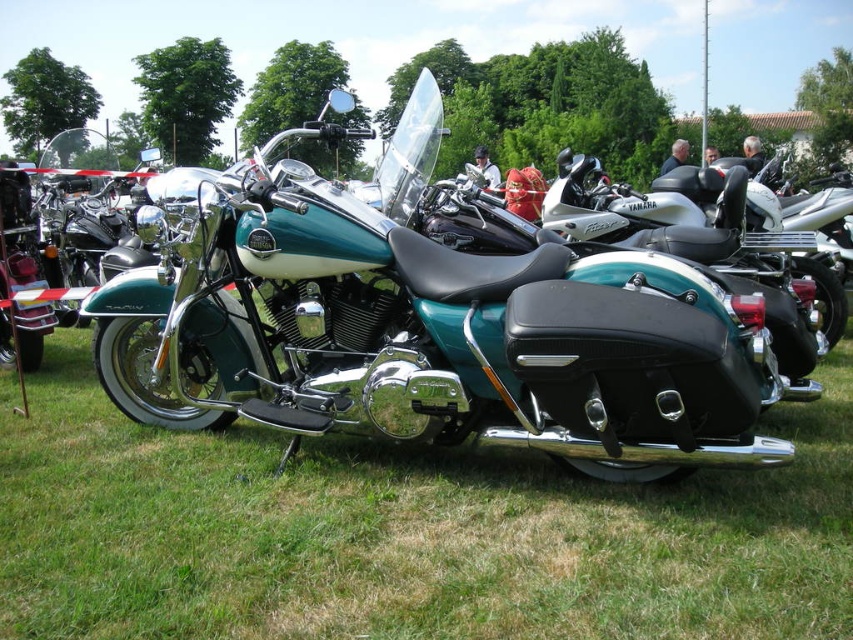
Question: Does green grass at center have a greater width compared to teal metallic motorcycle at center?

Choices:
 (A) no
 (B) yes

Answer: (B)

Question: Among these points, which one is nearest to the camera?

Choices:
 (A) (711, 168)
 (B) (254, 550)
 (C) (294, 188)

Answer: (B)

Question: Among these objects, which one is farthest from the camera?

Choices:
 (A) teal matte/silver motorcycle at center
 (B) teal metallic motorcycle at center
 (C) green grass at center

Answer: (A)

Question: Is green grass at center closer to camera compared to teal metallic motorcycle at center?

Choices:
 (A) no
 (B) yes

Answer: (B)

Question: Can you confirm if teal metallic motorcycle at center is positioned above teal matte/silver motorcycle at center?

Choices:
 (A) yes
 (B) no

Answer: (B)

Question: Which object appears closest to the camera in this image?

Choices:
 (A) teal metallic motorcycle at center
 (B) green grass at center
 (C) teal matte/silver motorcycle at center

Answer: (B)